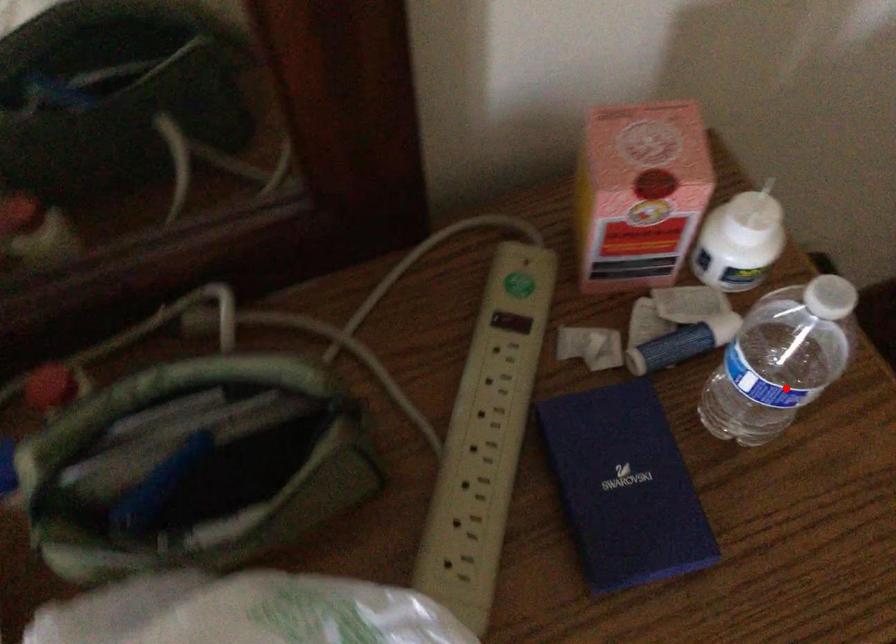
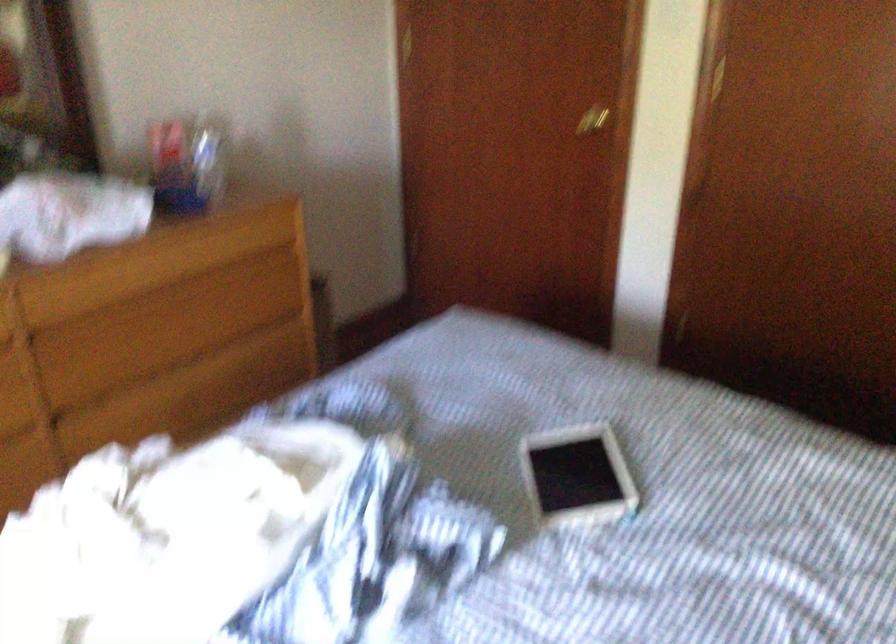
Question: I am providing you with two images of the same scene from different viewpoints. Given a red point in image1, look at the same physical point in image2. Is it:

Choices:
 (A) Closer to the viewpoint
 (B) Farther from the viewpoint

Answer: (B)